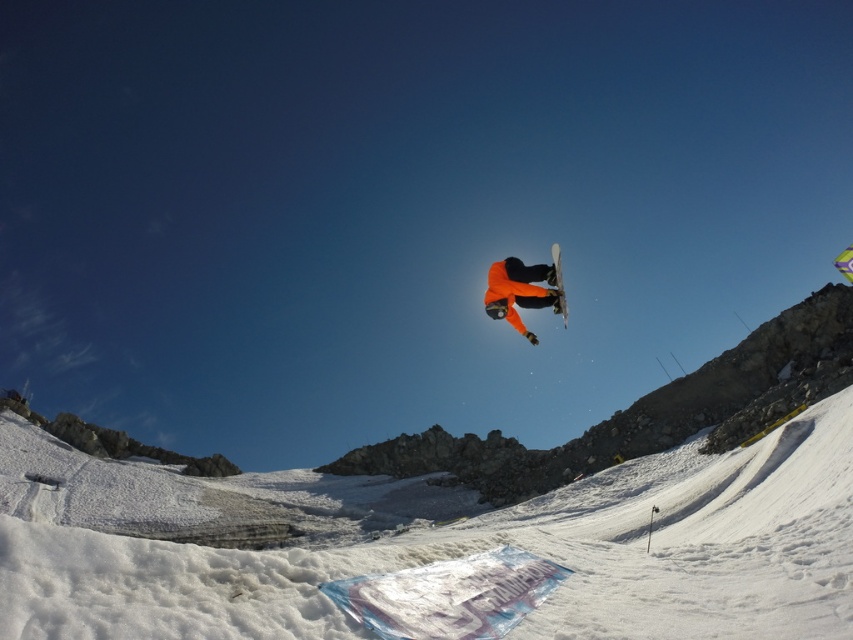
Looking at this image, you are standing at the base of the slope and want to reach the point marked at coordinates point (830, 497). If your snowboard can travel 100 meters before needing a rest, will you be able to reach the point without stopping?

The point (830, 497) is 99.36 meters from the viewer, so yes, you can reach it without stopping since it is within the 100 meter range of your snowboard.

You are a photographer trying to capture the snowboarder at point (519, 291). The camera is set to focus on the center of the image. Will the snowboarder be in focus?

The orange matte snowboarder at center is located at point (519, 291), which is the center of the image. Therefore, the snowboarder will be in focus.

You are a photographer trying to capture the snowboarder in midair. You notice the white powdery snow at center and the white matte snowboard at center in your frame. Which object takes up more space in the image?

The white powdery snow at center takes up more space in the image because it is bigger than the white matte snowboard at center.